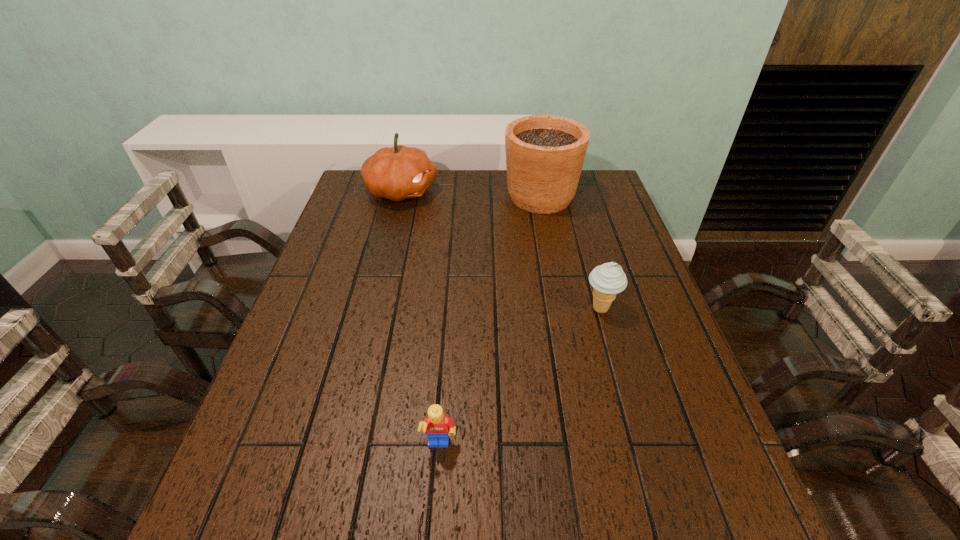
Find the location of a particular element. The image size is (960, 540). flowerpot is located at coordinates (545, 154).

The image size is (960, 540). I want to click on pumpkin, so click(x=397, y=173).

Identify the location of the leftmost object. The image size is (960, 540). (397, 173).

Where is `the third tallest object`? This screenshot has width=960, height=540. the third tallest object is located at coordinates (608, 279).

The width and height of the screenshot is (960, 540). In order to click on icecream in this screenshot , I will do `click(608, 279)`.

I want to click on Lego, so click(437, 426).

Locate an element on the screen. The image size is (960, 540). the shortest object is located at coordinates coord(437,426).

Where is `free space located on the front of the flowerpot`? The width and height of the screenshot is (960, 540). free space located on the front of the flowerpot is located at coordinates (560, 298).

Locate an element on the screen. The height and width of the screenshot is (540, 960). vacant space situated on the front face of the leftmost object is located at coordinates (493, 191).

Locate an element on the screen. Image resolution: width=960 pixels, height=540 pixels. free space located 0.210m on the left of the third farthest object is located at coordinates (500, 309).